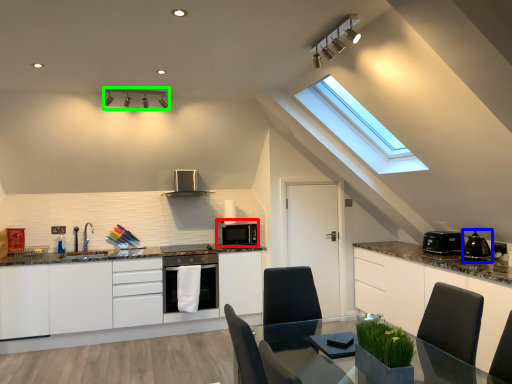
Question: Which object is positioned farthest from kitchen appliance (highlighted by a red box)? Select from appliance (highlighted by a blue box) and light fixture (highlighted by a green box).

Choices:
 (A) appliance
 (B) light fixture

Answer: (A)